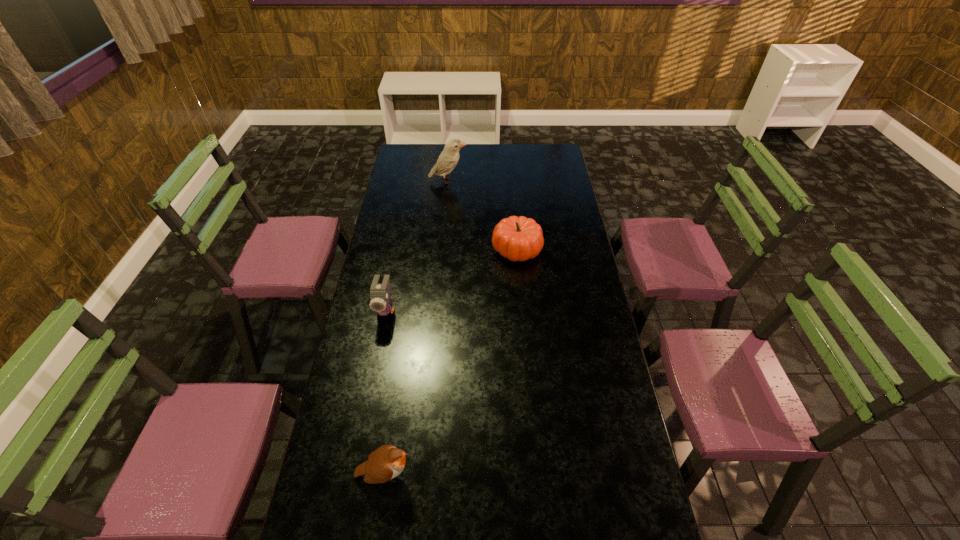
You are a GUI agent. You are given a task and a screenshot of the screen. Output one action in this format:
    pyautogui.click(x=<x>, y=<y>)
    Task: Click on the farthest object
    
    Given the screenshot: What is the action you would take?
    pyautogui.click(x=449, y=157)

Identify the location of the tallest bird. The width and height of the screenshot is (960, 540). (449, 157).

I want to click on the second farthest bird, so click(380, 301).

Where is `pumpkin`? The width and height of the screenshot is (960, 540). pumpkin is located at coordinates (519, 238).

This screenshot has height=540, width=960. Identify the location of the second farthest object. (519, 238).

The width and height of the screenshot is (960, 540). I want to click on the nearest bird, so click(387, 462).

You are a GUI agent. You are given a task and a screenshot of the screen. Output one action in this format:
    pyautogui.click(x=<x>, y=<y>)
    Task: Click on the free spot located 0.110m at the face of the farthest object
    This screenshot has height=540, width=960.
    Given the screenshot: What is the action you would take?
    pyautogui.click(x=489, y=181)

Where is `vacant space positioned at the beak of the second nearest object`? Image resolution: width=960 pixels, height=540 pixels. vacant space positioned at the beak of the second nearest object is located at coordinates (371, 388).

Find the location of `vacant region located on the back of the pumpkin`. vacant region located on the back of the pumpkin is located at coordinates (512, 193).

Find the location of a particular element. The image size is (960, 540). vacant area situated at the face of the nearest object is located at coordinates (465, 474).